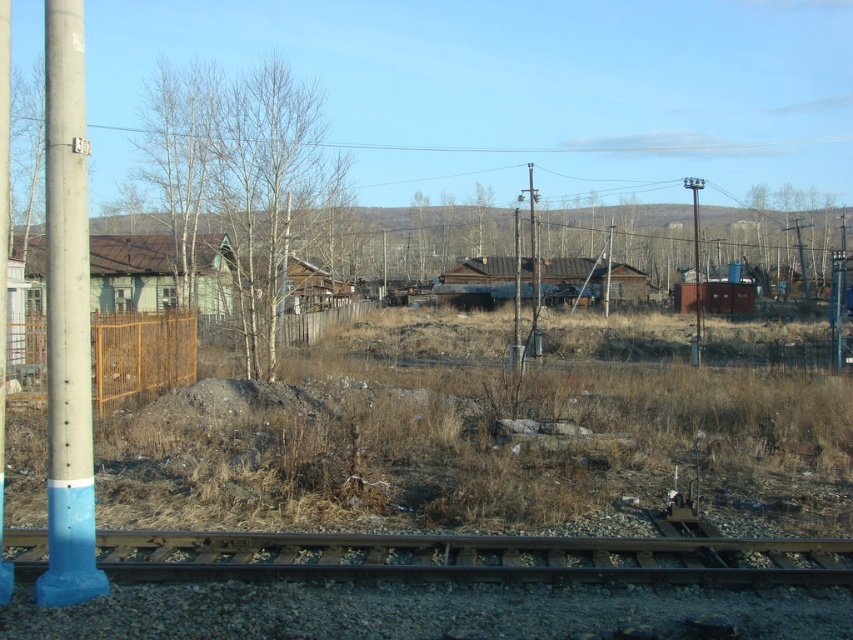
Consider the image. Who is shorter, bare wood tree at center or metallic pole at center?

metallic pole at center

Is the position of bare wood tree at center less distant than that of metallic pole at center?

A: Yes, it is in front of metallic pole at center.

In order to click on bare wood tree at center in this screenshot , I will do `click(241, 177)`.

Can you confirm if bare wood tree at center is positioned below blue painted concrete pole at left?

Actually, bare wood tree at center is above blue painted concrete pole at left.

Find the location of a particular element. The width and height of the screenshot is (853, 640). bare wood tree at center is located at coordinates (241, 177).

You are a GUI agent. You are given a task and a screenshot of the screen. Output one action in this format:
    pyautogui.click(x=<x>, y=<y>)
    Task: Click on the bare wood tree at center
    
    Given the screenshot: What is the action you would take?
    pyautogui.click(x=241, y=177)

From the picture: Is bare wood tree at center smaller than yellow wire mesh fence at left?

Actually, bare wood tree at center might be larger than yellow wire mesh fence at left.

Does bare wood tree at center appear on the left side of yellow wire mesh fence at left?

Indeed, bare wood tree at center is positioned on the left side of yellow wire mesh fence at left.

Does point (192, 156) come farther from viewer compared to point (10, 358)?

Yes, point (192, 156) is farther from viewer.

You are a GUI agent. You are given a task and a screenshot of the screen. Output one action in this format:
    pyautogui.click(x=<x>, y=<y>)
    Task: Click on the bare wood tree at center
    
    Given the screenshot: What is the action you would take?
    pyautogui.click(x=241, y=177)